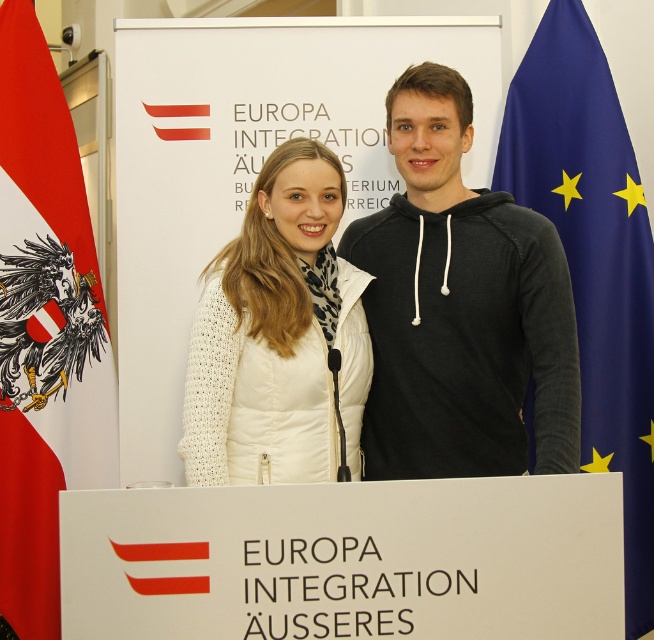
You are standing in front of the podium with the banner. Where is the black hoodie at center located?

The black hoodie at center is located at point (460,307).

You are attending a formal event about European integration and notice two items in the scene. Which item is closer to you between the blue fabric flag at right and the white knitted jacket at center?

The blue fabric flag at right is closer to you than the white knitted jacket at center.

You are standing in front of the podium at the European integration event. You see the blue fabric flag at right. Where is it positioned relative to the podium?

The blue fabric flag at right is located at point (593, 257) relative to the podium.